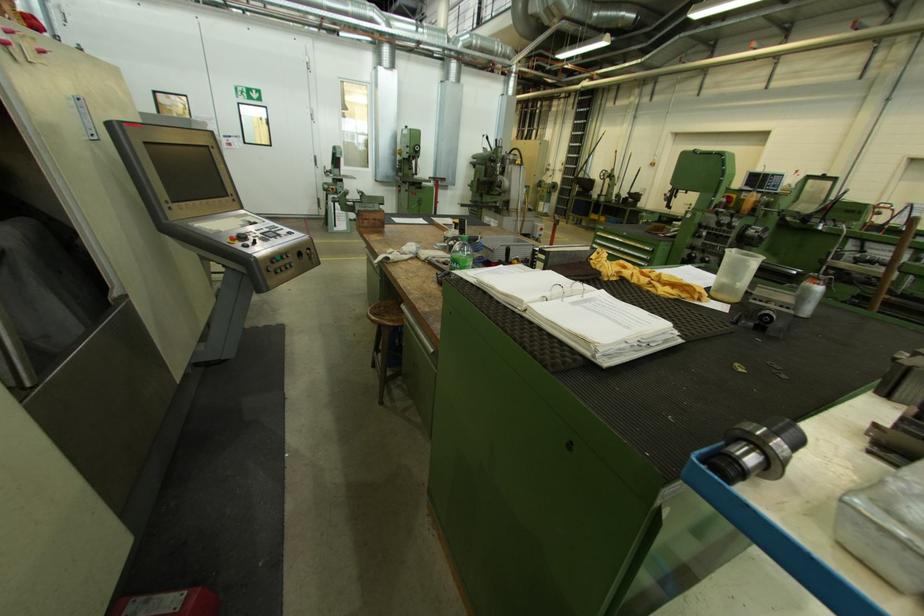
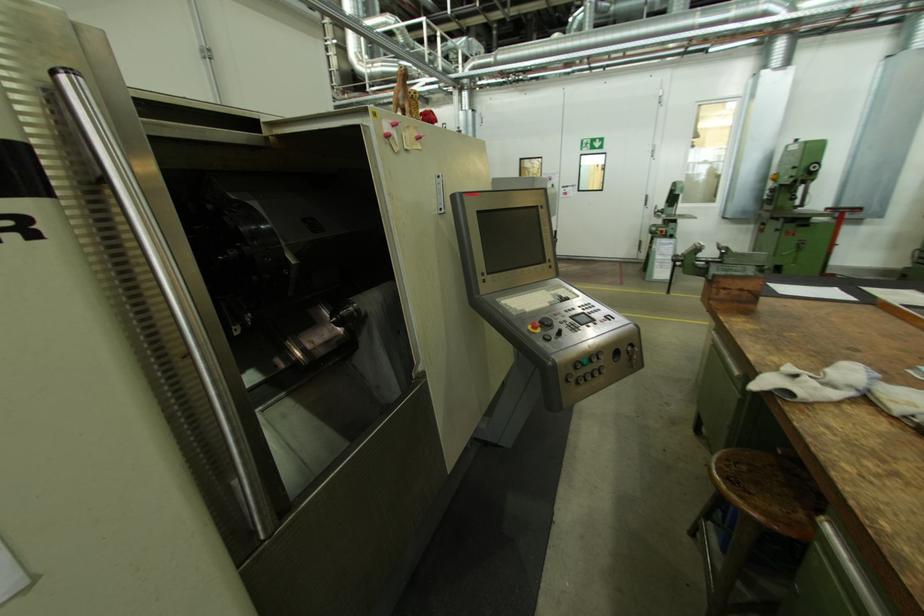
Find the pixel in the second image that matches point (287, 259) in the first image.

(596, 362)